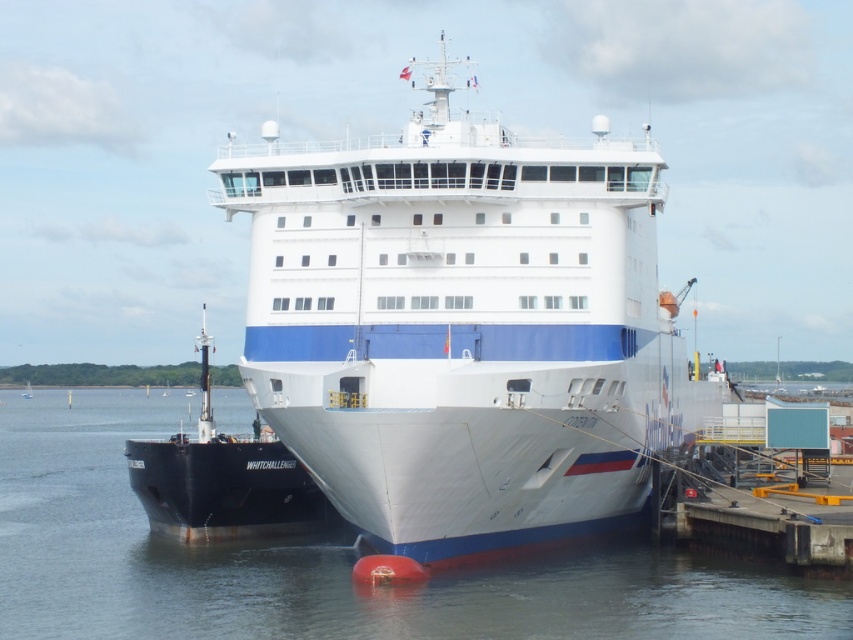
Question: Which point appears closest to the camera in this image?

Choices:
 (A) (291, 518)
 (B) (77, 468)

Answer: (A)

Question: Can you confirm if white glossy water at center is thinner than black matte ship at left?

Choices:
 (A) no
 (B) yes

Answer: (A)

Question: From the image, what is the correct spatial relationship of white glossy water at center in relation to black matte ship at left?

Choices:
 (A) left
 (B) right

Answer: (A)

Question: Which object is farther from the camera taking this photo?

Choices:
 (A) black matte ship at left
 (B) white glossy water at center

Answer: (A)

Question: Is white glossy water at center to the left of black matte ship at left from the viewer's perspective?

Choices:
 (A) no
 (B) yes

Answer: (B)